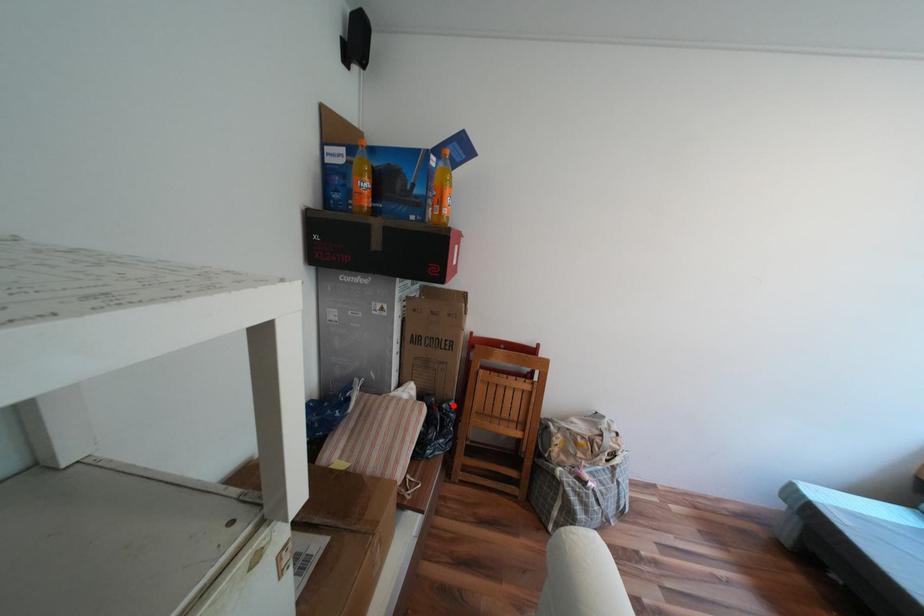
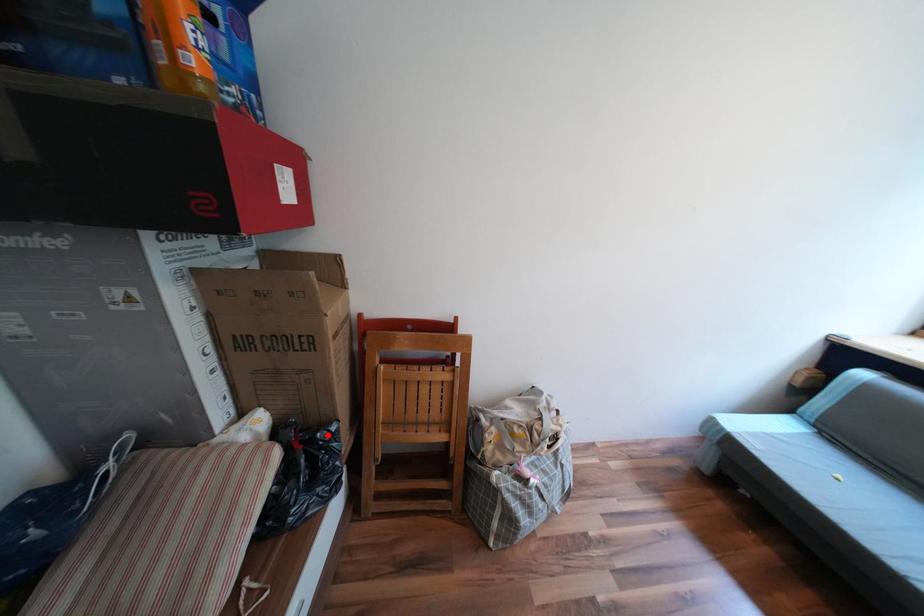
I am providing you with two images of the same scene from different viewpoints. A red point is marked on the first image and another point is marked on the second image. Is the marked point in image1 the same physical position as the marked point in image2?

Yes